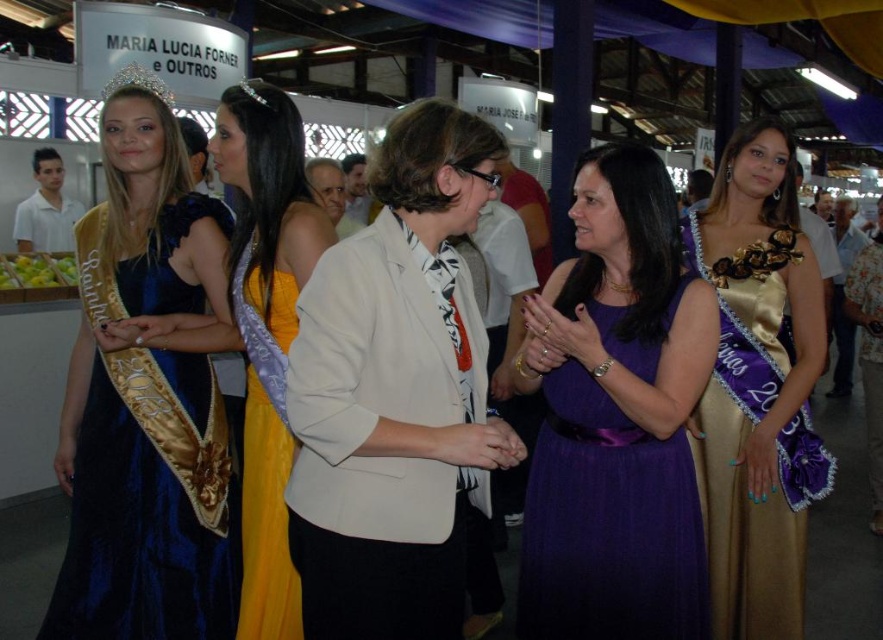
You are a photographer at the event and need to capture a photo where both the gold satin dress at right and the gold shiny tiara at upper left are visible. Considering their sizes, which one might appear larger in the photo?

The gold satin dress at right is taller than the gold shiny tiara at upper left, so it will appear larger in the photo.

You are a photographer setting up a camera to capture the two women in the velvet blue dress at left and the blue satin dress at upper left. Since you want to ensure both are in focus, you need to know which dress has a narrower silhouette. Which one is thinner?

The velvet blue dress at left is thinner than the blue satin dress at upper left, so the velvet blue dress at left has a narrower silhouette.